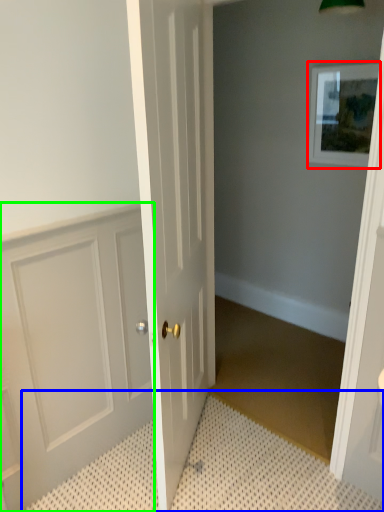
Question: Which object is the farthest from picture frame (highlighted by a red box)? Choose among these: bath mat (highlighted by a blue box) or door (highlighted by a green box).

Choices:
 (A) bath mat
 (B) door

Answer: (A)